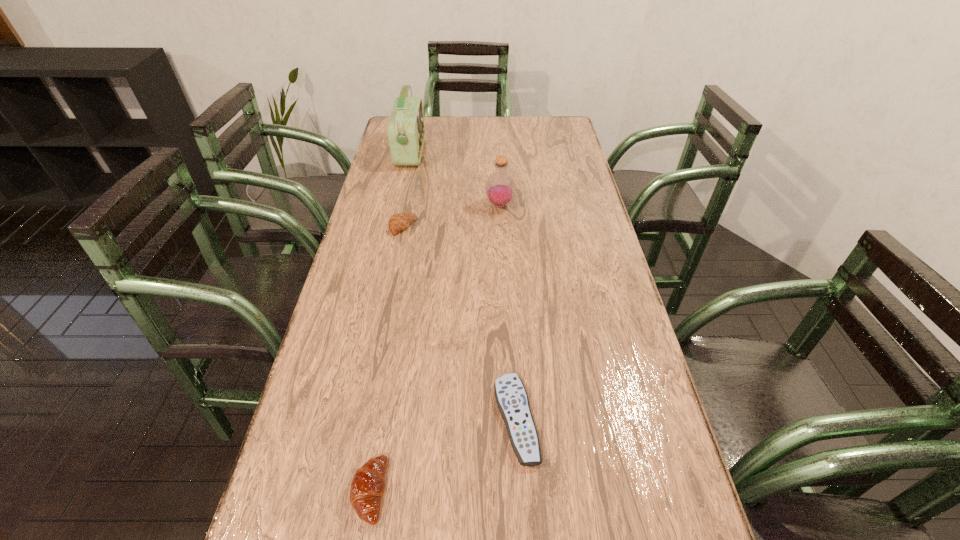
Image resolution: width=960 pixels, height=540 pixels. What are the coordinates of `vacant region that satisfies the following two spatial constraints: 1. on the back side of the shortest object; 2. on the left side of the nearer crescent roll` in the screenshot? It's located at (381, 420).